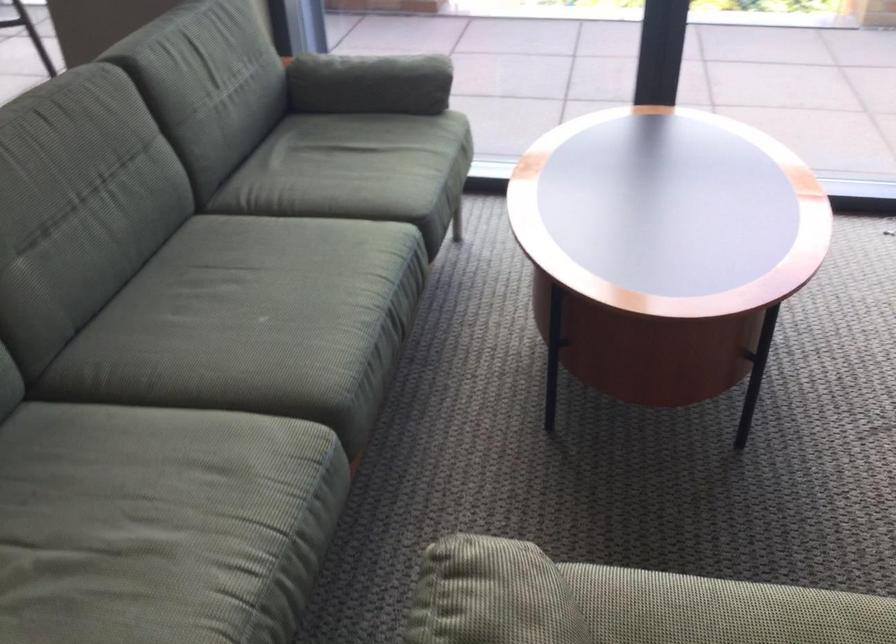
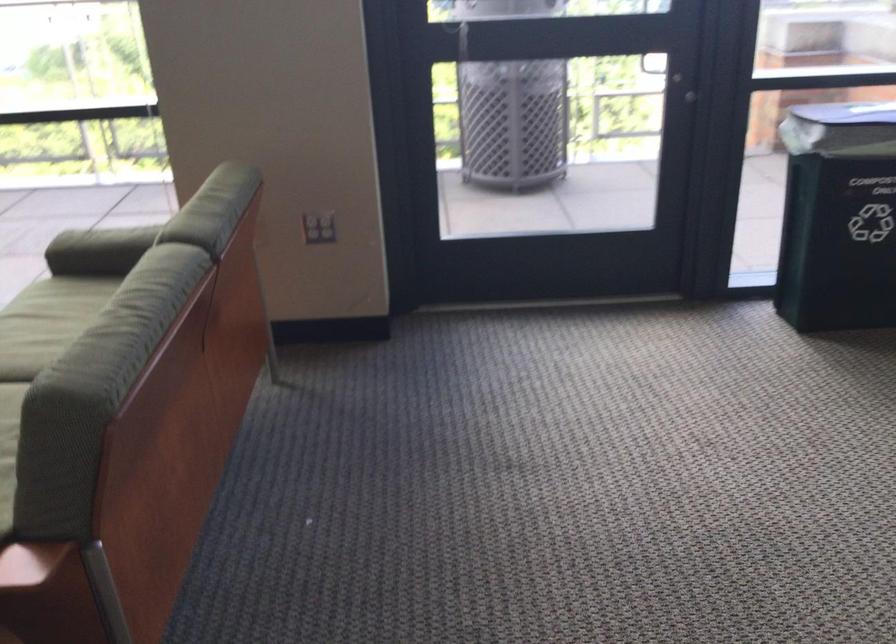
Question: The images are taken continuously from a first-person perspective. In which direction are you moving?

Choices:
 (A) Left
 (B) Right
 (C) Forward
 (D) Backward

Answer: (B)